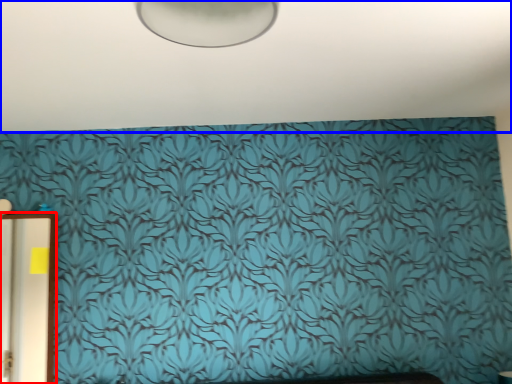
Question: Among these objects, which one is farthest to the camera, door (highlighted by a red box) or backdrop (highlighted by a blue box)?

Choices:
 (A) door
 (B) backdrop

Answer: (A)